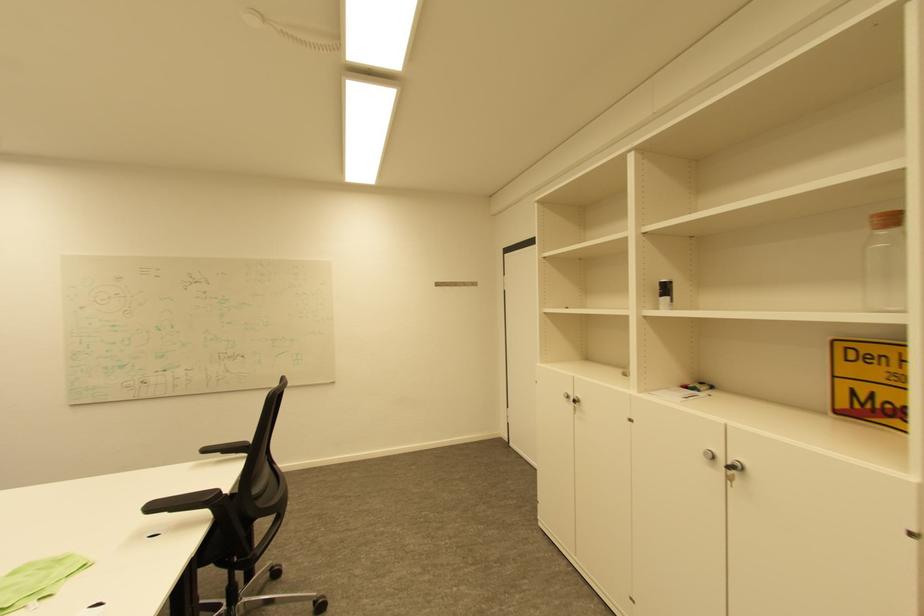
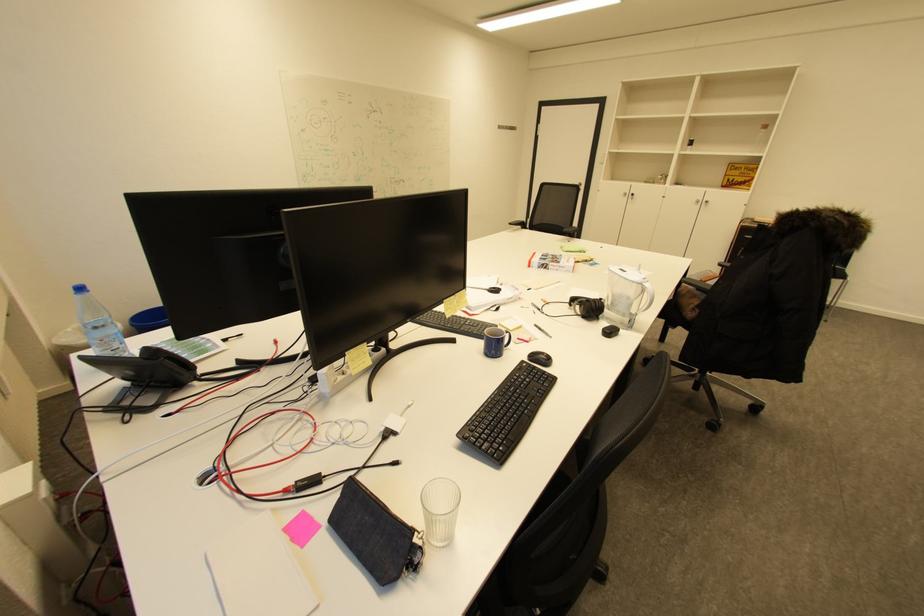
In the second image, find the point that corresponds to (x=213, y=450) in the first image.

(517, 225)